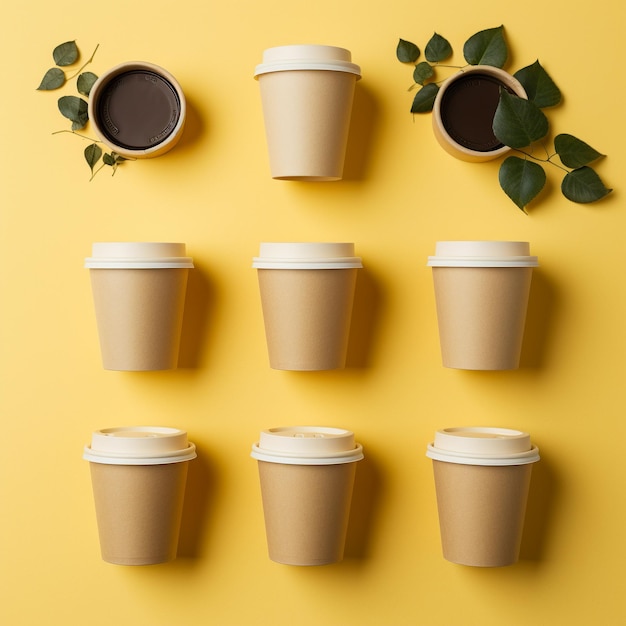
The height and width of the screenshot is (626, 626). Identify the location of cup viewed from side. (496, 506), (305, 493), (163, 486), (494, 300), (316, 294), (148, 290), (297, 99).